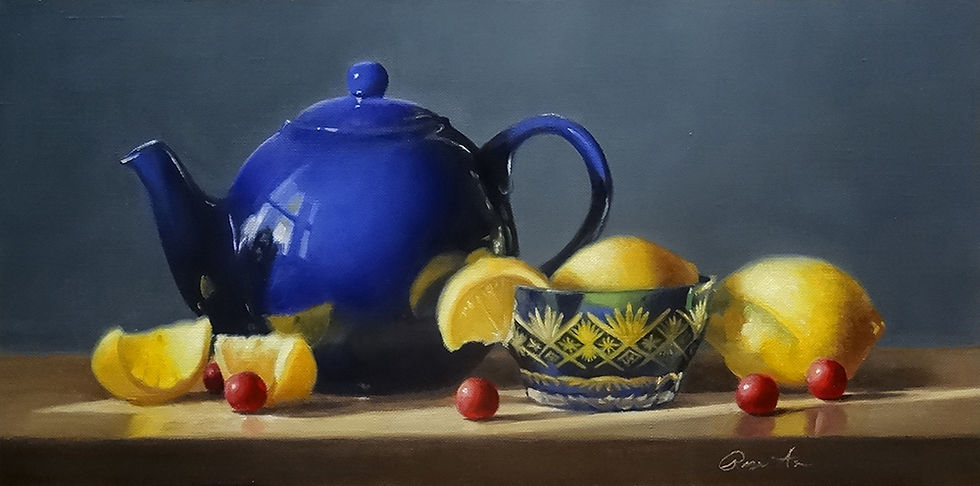
Find the location of `ornate glass bowel holding a lemon`. ornate glass bowel holding a lemon is located at coordinates (592, 331).